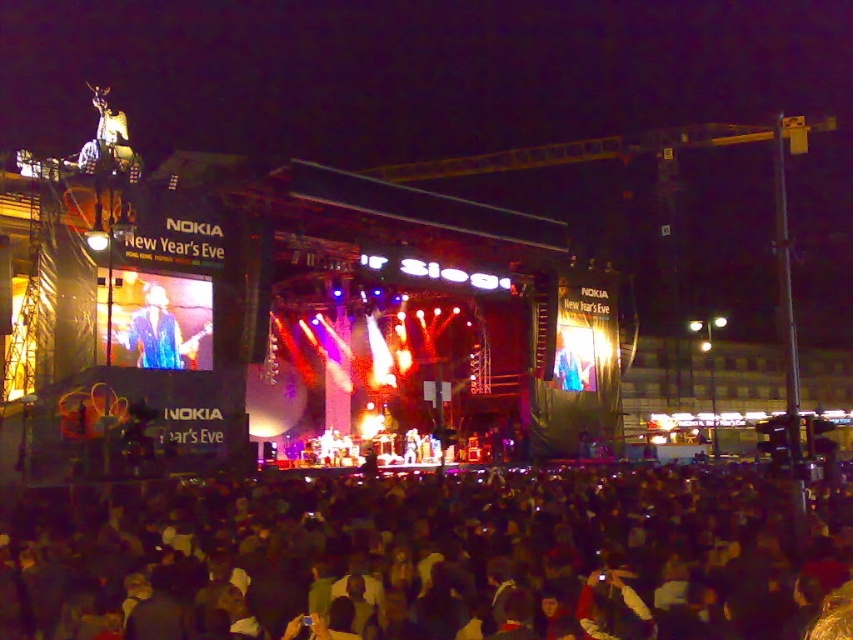
Which is above, dark fabric crowd at lower center or blue denim jacket at upper left?

blue denim jacket at upper left is above.

This screenshot has width=853, height=640. I want to click on dark fabric crowd at lower center, so click(422, 556).

Is point (645, 529) positioned behind point (154, 323)?

No, it is not.

This screenshot has width=853, height=640. I want to click on dark fabric crowd at lower center, so click(422, 556).